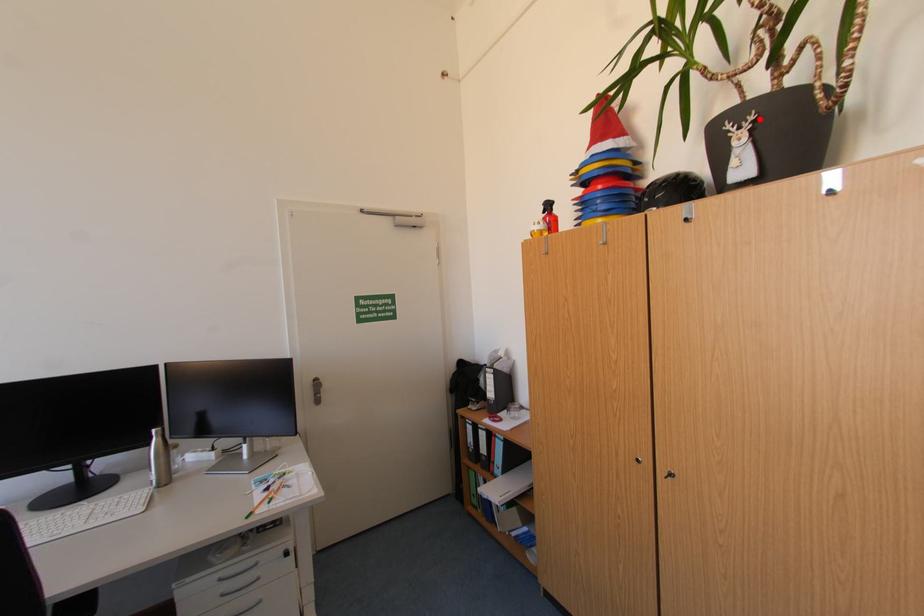
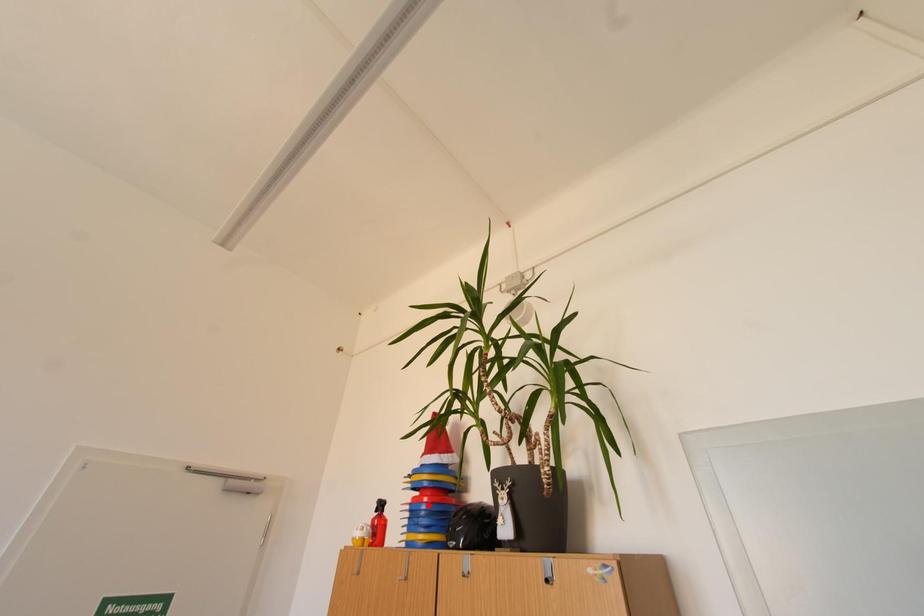
I am providing you with two images of the same scene from different viewpoints. A red point is marked on the first image and another point is marked on the second image. Is the marked point in image1 the same physical position as the marked point in image2?

No